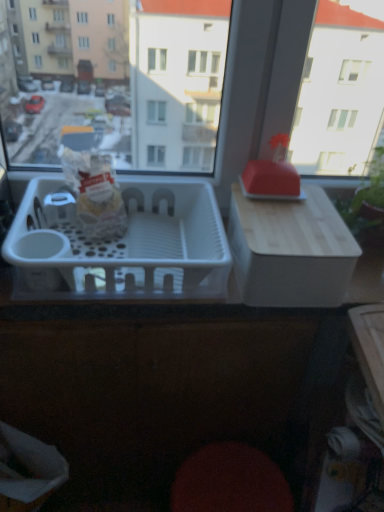
Image resolution: width=384 pixels, height=512 pixels. What do you see at coordinates (290, 250) in the screenshot?
I see `white plastic container at right` at bounding box center [290, 250].

The width and height of the screenshot is (384, 512). What do you see at coordinates (95, 194) in the screenshot?
I see `matte white bag at center` at bounding box center [95, 194].

This screenshot has height=512, width=384. In order to click on green leafy plant at upper right in this screenshot , I will do `click(367, 204)`.

Describe the element at coordinates (124, 243) in the screenshot. This screenshot has height=512, width=384. I see `white plastic basket at center` at that location.

Find the location of `white plastic container at right`. white plastic container at right is located at coordinates (290, 250).

Based on the photo, which is in front, white plastic container at right or green leafy plant at upper right?

white plastic container at right.

From a real-world perspective, is white plastic container at right physically below green leafy plant at upper right?

Yes, from a real-world perspective, white plastic container at right is under green leafy plant at upper right.

Does white plastic container at right contain green leafy plant at upper right?

No, white plastic container at right does not contain green leafy plant at upper right.

From the picture: From the image's perspective, is white plastic container at right on green leafy plant at upper right?

Incorrect, from the image's perspective, white plastic container at right is lower than green leafy plant at upper right.

Is matte white bag at center to the right of white plastic basket at center from the viewer's perspective?

No.

From the image's perspective, does matte white bag at center appear lower than white plastic basket at center?

Incorrect, from the image's perspective, matte white bag at center is higher than white plastic basket at center.

Can you confirm if matte white bag at center is bigger than white plastic basket at center?

Incorrect, matte white bag at center is not larger than white plastic basket at center.

Is point (103, 178) positioned in front of point (72, 264)?

No, it is behind (72, 264).

In terms of width, does green leafy plant at upper right look wider or thinner when compared to white plastic basket at center?

In the image, green leafy plant at upper right appears to be more narrow than white plastic basket at center.

From a real-world perspective, is green leafy plant at upper right under white plastic basket at center?

Actually, green leafy plant at upper right is physically above white plastic basket at center in the real world.

Can you confirm if green leafy plant at upper right is positioned to the right of white plastic basket at center?

Indeed, green leafy plant at upper right is positioned on the right side of white plastic basket at center.

Is green leafy plant at upper right inside the boundaries of matte white bag at center, or outside?

green leafy plant at upper right is not enclosed by matte white bag at center.

Considering the sizes of objects green leafy plant at upper right and matte white bag at center in the image provided, who is wider, green leafy plant at upper right or matte white bag at center?

Wider between the two is matte white bag at center.

Does green leafy plant at upper right come in front of matte white bag at center?

No.

Are green leafy plant at upper right and matte white bag at center far apart?

No, there isn't a large distance between green leafy plant at upper right and matte white bag at center.

Between matte white bag at center and green leafy plant at upper right, which one has smaller width?

With smaller width is green leafy plant at upper right.

Does matte white bag at center turn towards green leafy plant at upper right?

No, matte white bag at center does not turn towards green leafy plant at upper right.

Is matte white bag at center not inside green leafy plant at upper right?

Yes, matte white bag at center is not within green leafy plant at upper right.

Is green leafy plant at upper right outside of white plastic container at right?

Yes, green leafy plant at upper right is outside of white plastic container at right.

Does green leafy plant at upper right appear on the left side of white plastic container at right?

No.

Who is taller, green leafy plant at upper right or white plastic container at right?

Standing taller between the two is green leafy plant at upper right.

Between point (367, 209) and point (341, 287), which one is positioned in front?

The point (341, 287) is closer.

How many degrees apart are the facing directions of white plastic basket at center and white plastic container at right?

There is a 0.132-degree angle between the facing directions of white plastic basket at center and white plastic container at right.

Who is more distant, white plastic basket at center or white plastic container at right?

Result: white plastic container at right is further from the camera.

From a real-world perspective, is white plastic basket at center on white plastic container at right?

Incorrect, from a real-world perspective, white plastic basket at center is lower than white plastic container at right.

Which object is thinner, white plastic basket at center or white plastic container at right?

white plastic container at right is thinner.

In order to click on cardboard box that is in front of the green leafy plant at upper right in this screenshot , I will do `click(290, 250)`.

Locate an element on the screen. The height and width of the screenshot is (512, 384). basket below the matte white bag at center (from a real-world perspective) is located at coordinates [124, 243].

From the picture: Which object lies further to the anchor point white plastic container at right, white plastic basket at center or matte white bag at center?

The object further to white plastic container at right is matte white bag at center.

Looking at the image, which one is located closer to white plastic basket at center, white plastic container at right or matte white bag at center?

The object closer to white plastic basket at center is matte white bag at center.

Which object lies nearer to the anchor point white plastic container at right, matte white bag at center or white plastic basket at center?

white plastic basket at center is closer to white plastic container at right.

Based on their spatial positions, is matte white bag at center or green leafy plant at upper right closer to white plastic container at right?

The object closer to white plastic container at right is green leafy plant at upper right.

Looking at the image, which one is located closer to white plastic basket at center, white plastic container at right or green leafy plant at upper right?

white plastic container at right.

Estimate the real-world distances between objects in this image. Which object is closer to white plastic basket at center, green leafy plant at upper right or matte white bag at center?

Based on the image, matte white bag at center appears to be nearer to white plastic basket at center.

Considering their positions, is matte white bag at center positioned further to green leafy plant at upper right than white plastic container at right?

matte white bag at center.

Considering their positions, is matte white bag at center positioned closer to green leafy plant at upper right than white plastic basket at center?

The object closer to green leafy plant at upper right is white plastic basket at center.

Find the location of a particular element. Image resolution: width=384 pixels, height=512 pixels. basket situated between matte white bag at center and green leafy plant at upper right from left to right is located at coordinates (124, 243).

I want to click on cardboard box between matte white bag at center and green leafy plant at upper right in the horizontal direction, so click(x=290, y=250).

The width and height of the screenshot is (384, 512). Identify the location of cardboard box located between white plastic basket at center and green leafy plant at upper right in the left-right direction. (290, 250).

Identify the location of basket between matte white bag at center and white plastic container at right. (124, 243).